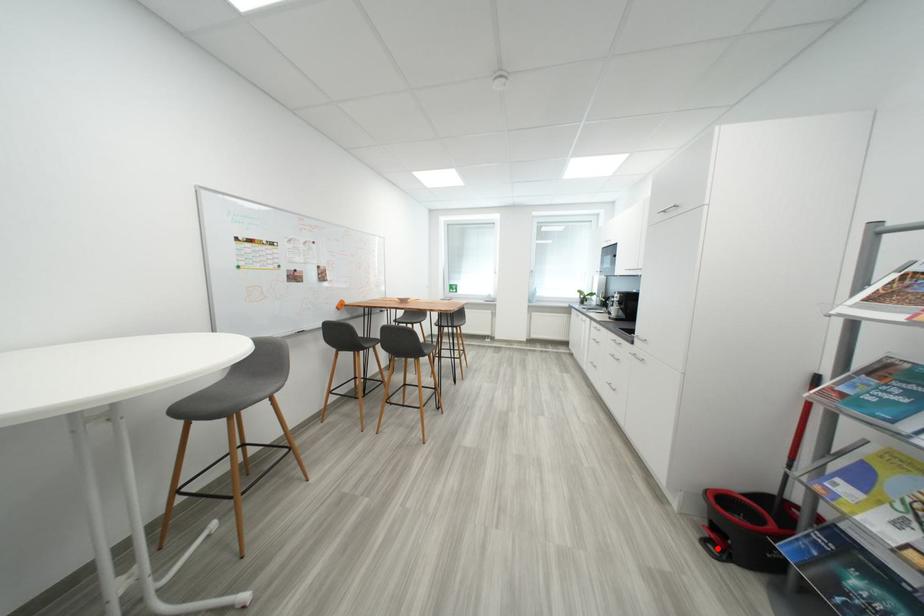
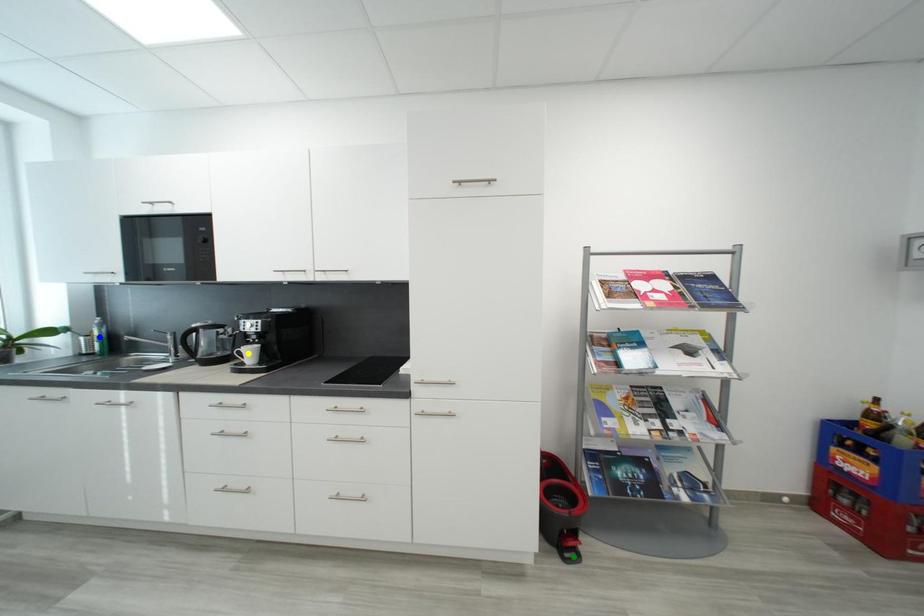
Question: I am providing you with two images of the same scene from different viewpoints. A red point is marked on the first image. You are given multiple points on the second image. In image 2, which mark is for the same physical point as the one in image 1?

Choices:
 (A) blue point
 (B) green point
 (C) yellow point

Answer: (B)